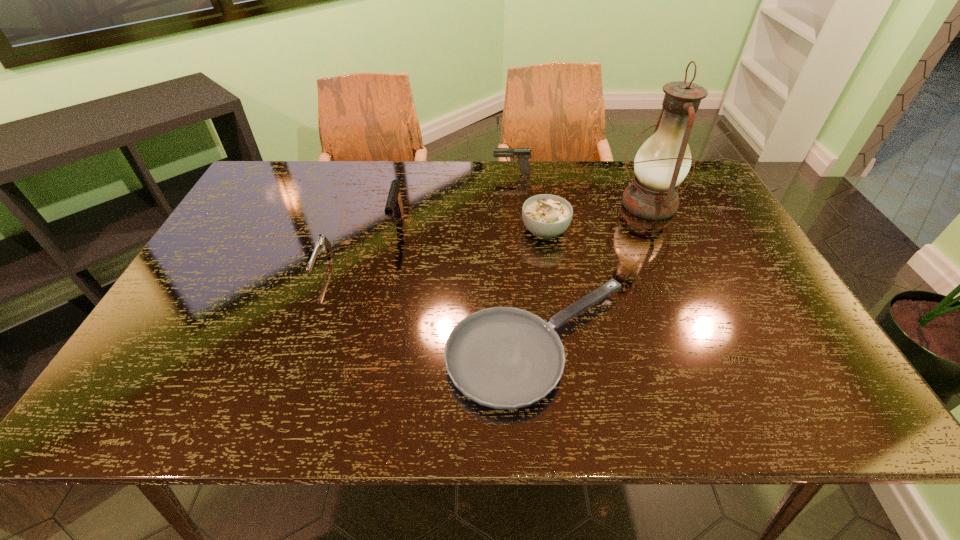
Locate an element on the screen. This screenshot has height=540, width=960. pistol located at the far edge is located at coordinates click(523, 154).

Identify the location of object that is at the near edge. (502, 357).

You are a GUI agent. You are given a task and a screenshot of the screen. Output one action in this format:
    pyautogui.click(x=<x>, y=<y>)
    Task: Click on the object positioned at the right edge
    This screenshot has width=960, height=540.
    Given the screenshot: What is the action you would take?
    pyautogui.click(x=663, y=161)

Find the location of a particular element. The width and height of the screenshot is (960, 540). object located in the far right corner section of the desktop is located at coordinates (663, 161).

Locate an element on the screen. free space at the far edge of the desktop is located at coordinates (329, 194).

Where is `vacant space at the near edge of the desktop`? vacant space at the near edge of the desktop is located at coordinates (732, 389).

In the image, there is a desktop. Identify the location of vacant space at the left edge. This screenshot has height=540, width=960. (238, 222).

I want to click on free space at the right edge of the desktop, so click(x=720, y=309).

In the image, there is a desktop. Where is `vacant area at the far left corner`? This screenshot has width=960, height=540. vacant area at the far left corner is located at coordinates click(258, 187).

The width and height of the screenshot is (960, 540). I want to click on vacant space at the far right corner of the desktop, so tap(696, 179).